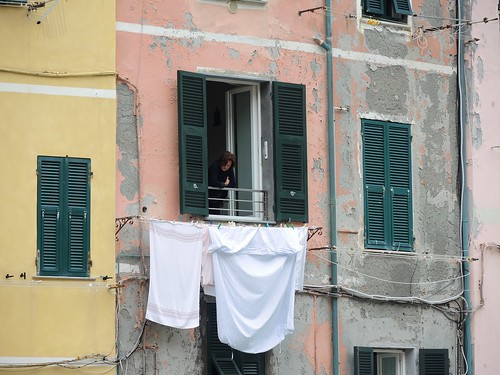
At what (x,y) coordinates should I click in order to perform the action: click on window. Please return your answer as a coordinate pair (x, y). Image resolution: width=500 pixels, height=375 pixels. Looking at the image, I should click on (260, 174), (387, 176).